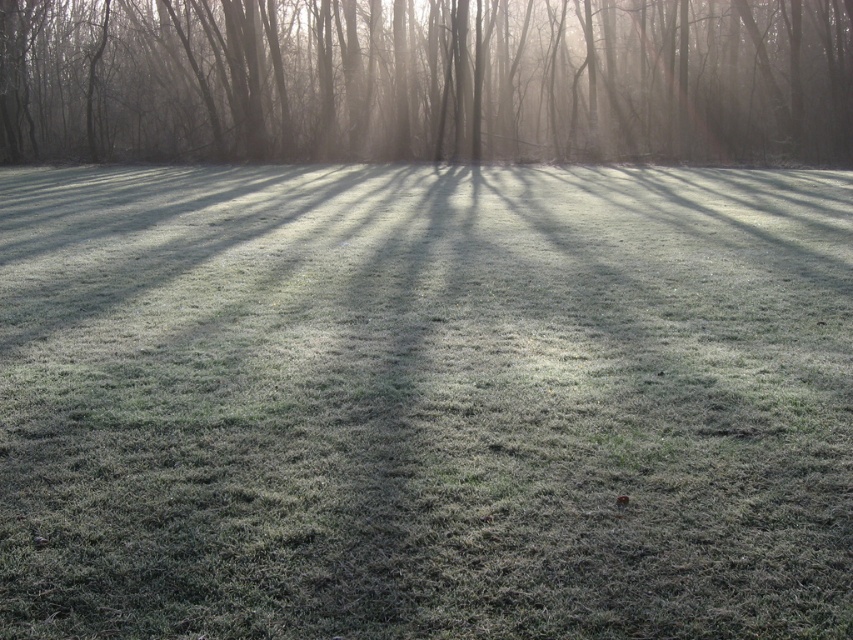
Question: Can you confirm if frosted grass at center is positioned below smooth bark tree at upper center?

Choices:
 (A) no
 (B) yes

Answer: (B)

Question: Is frosted grass at center below smooth bark tree at upper center?

Choices:
 (A) yes
 (B) no

Answer: (A)

Question: Which object appears closest to the camera in this image?

Choices:
 (A) smooth bark tree at upper center
 (B) frosted grass at center

Answer: (B)

Question: Does frosted grass at center come behind smooth bark tree at upper center?

Choices:
 (A) yes
 (B) no

Answer: (B)

Question: Which point is closer to the camera?

Choices:
 (A) smooth bark tree at upper center
 (B) frosted grass at center

Answer: (B)